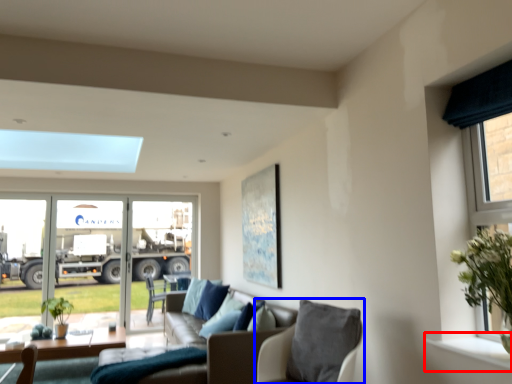
Question: Which point is further to the camera, window sill (highlighted by a red box) or chair (highlighted by a blue box)?

Choices:
 (A) window sill
 (B) chair

Answer: (B)